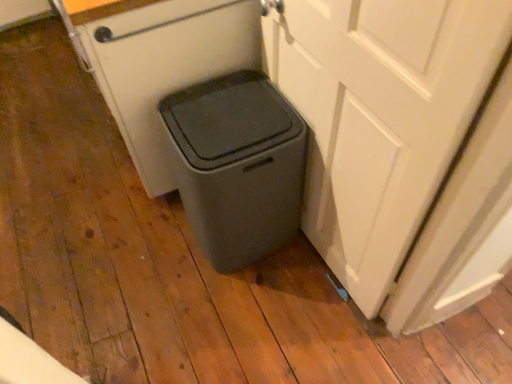
Where is `free space in front of white matte door at right`? This screenshot has width=512, height=384. free space in front of white matte door at right is located at coordinates (303, 340).